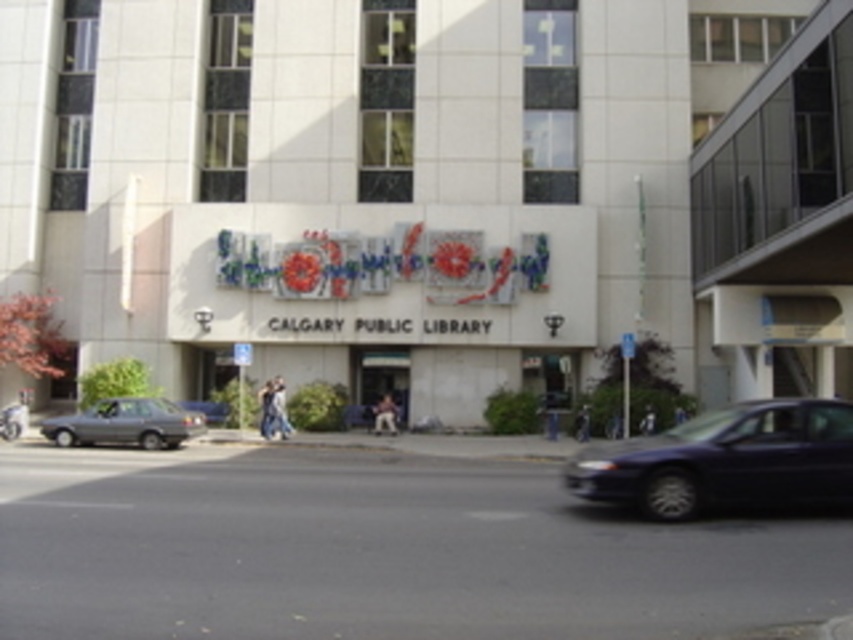
You are standing at the entrance of the Calgary Public Library and want to take a photo of the metallic gray car at center. Where should you position yourself to capture the car in the frame?

To capture the metallic gray car at center in your photo, position yourself at the entrance of the Calgary Public Library and aim your camera towards the center of the scene, where the car is located at coordinates approximately 0.863 on the x axis and 0.450 on the y axis.

You are a pedestrian standing on the sidewalk in front of the Calgary Public Library. You need to cross the street to reach the park on the other side. There are two cars in your path. Which car, the metallic gray car at center or the dark blue sedan at lower right, is closer to you so you can decide to walk around it first?

The metallic gray car at center is closer to you than the dark blue sedan at lower right, so you should walk around it first before proceeding.

You are a delivery person who needs to park a tall delivery van that is 2 meters in height. You see the metallic gray car at center and the matte gray sedan at lower left parked on the sidewalk. Which parking spot between these two vehicles would be suitable for your van if the parking spot requires a minimum height clearance of 2 meters?

The metallic gray car at center has a greater height compared to matte gray sedan at lower left. Since your van is 2 meters tall, you should choose the parking spot near the metallic gray car at center as it likely has sufficient height clearance.